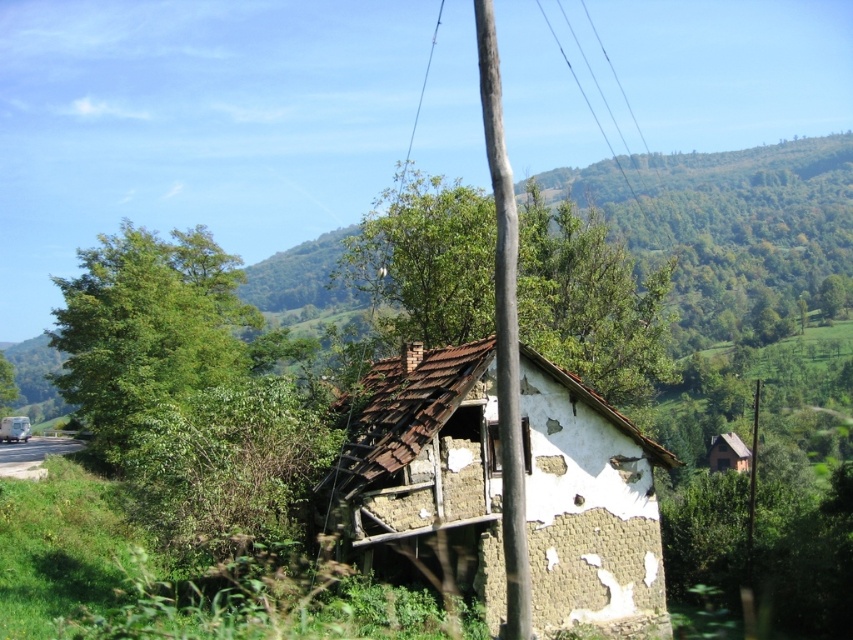
Does wooden thatched hut at lower right have a smaller size compared to smooth wire at upper center?

Correct, wooden thatched hut at lower right occupies less space than smooth wire at upper center.

Is wooden thatched hut at lower right wider than smooth wire at upper center?

In fact, wooden thatched hut at lower right might be narrower than smooth wire at upper center.

At what (x,y) coordinates should I click in order to perform the action: click on wooden thatched hut at lower right. Please return your answer as a coordinate pair (x, y). Looking at the image, I should click on (728, 452).

Does green leafy tree at center have a greater height compared to brown wooden telegraph pole at center?

Correct, green leafy tree at center is much taller as brown wooden telegraph pole at center.

Who is more distant from viewer, (473, 321) or (490, 8)?

Point (473, 321)

Which is in front, point (531, 260) or point (498, 141)?

Point (498, 141)

Where is `green leafy tree at center`? This screenshot has height=640, width=853. green leafy tree at center is located at coordinates (x=590, y=301).

This screenshot has height=640, width=853. What do you see at coordinates (590, 301) in the screenshot?
I see `green leafy tree at center` at bounding box center [590, 301].

Is green leafy tree at center thinner than green leafy tree at left?

Correct, green leafy tree at center's width is less than green leafy tree at left's.

Locate an element on the screen. The width and height of the screenshot is (853, 640). green leafy tree at center is located at coordinates (590, 301).

This screenshot has height=640, width=853. I want to click on green leafy tree at center, so click(590, 301).